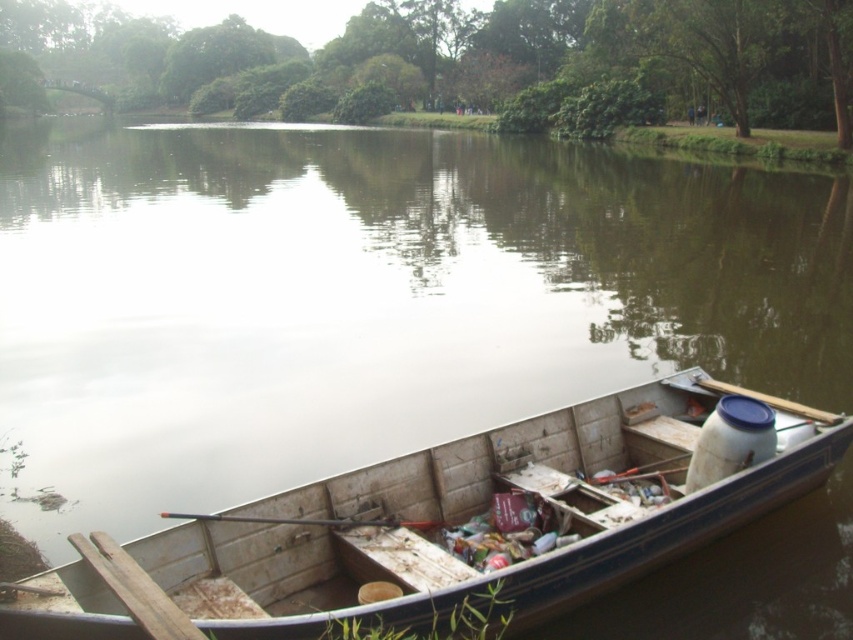
Question: Which point appears closest to the camera in this image?

Choices:
 (A) click(x=416, y=381)
 (B) click(x=144, y=554)

Answer: (B)

Question: Which object appears farthest from the camera in this image?

Choices:
 (A) brown wooden river at center
 (B) wooden boat at lower right

Answer: (B)

Question: In this image, where is brown wooden river at center located relative to wooden boat at lower right?

Choices:
 (A) left
 (B) right

Answer: (A)

Question: In this image, where is brown wooden river at center located relative to wooden boat at lower right?

Choices:
 (A) right
 (B) left

Answer: (B)

Question: Where is brown wooden river at center located in relation to wooden boat at lower right in the image?

Choices:
 (A) above
 (B) below

Answer: (A)

Question: Which point is closer to the camera?

Choices:
 (A) (331, 528)
 (B) (836, 540)

Answer: (A)